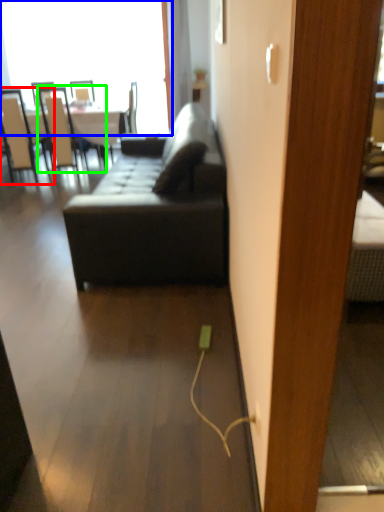
Question: Which object is the farthest from chair (highlighted by a red box)? Choose among these: window (highlighted by a blue box) or chair (highlighted by a green box).

Choices:
 (A) window
 (B) chair

Answer: (A)